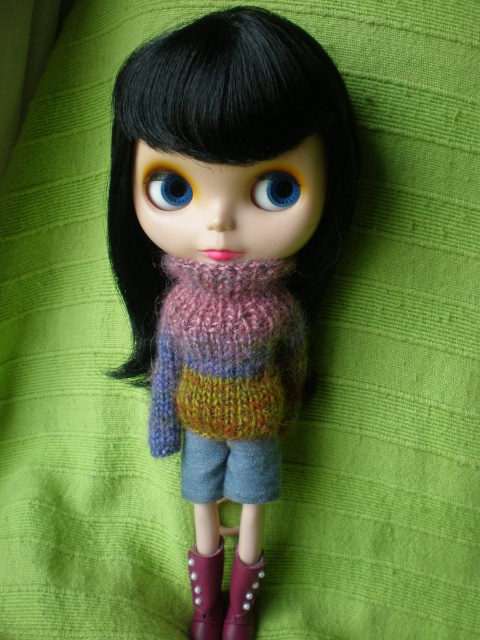
You are a fashion designer trying to create a pair of boots that match the doll perfectly. The doll has two boots at the lower center, one labeled as purple suede boot at lower center and the other as shiny purple boot at lower center. Since they need to be paired together, can you confirm if the space between them is sufficient to place both boots side by side?

The distance between the purple suede boot at lower center and the shiny purple boot at lower center is 1.52 inches. Since they are meant to be placed side by side, this distance indicates that there is enough space to accommodate both boots without overlapping.